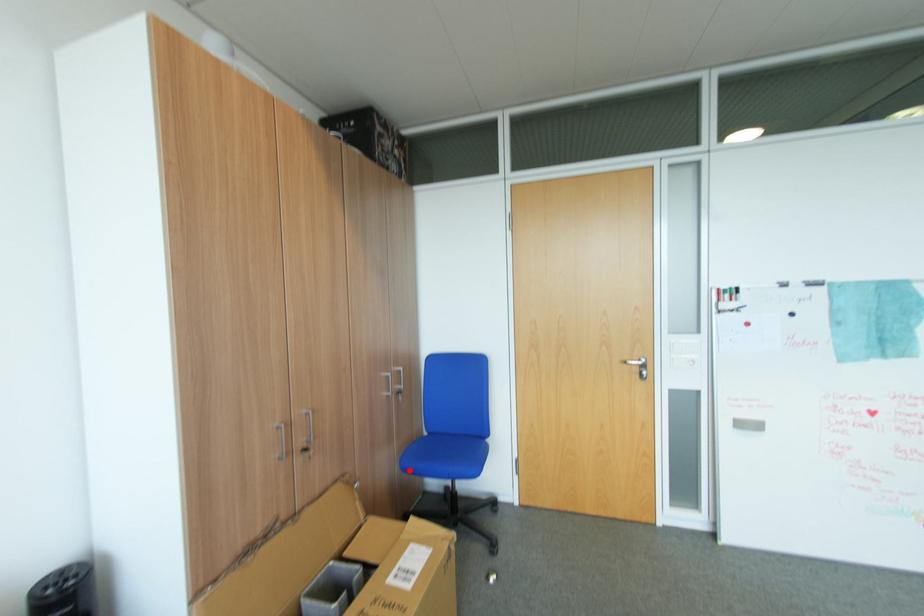
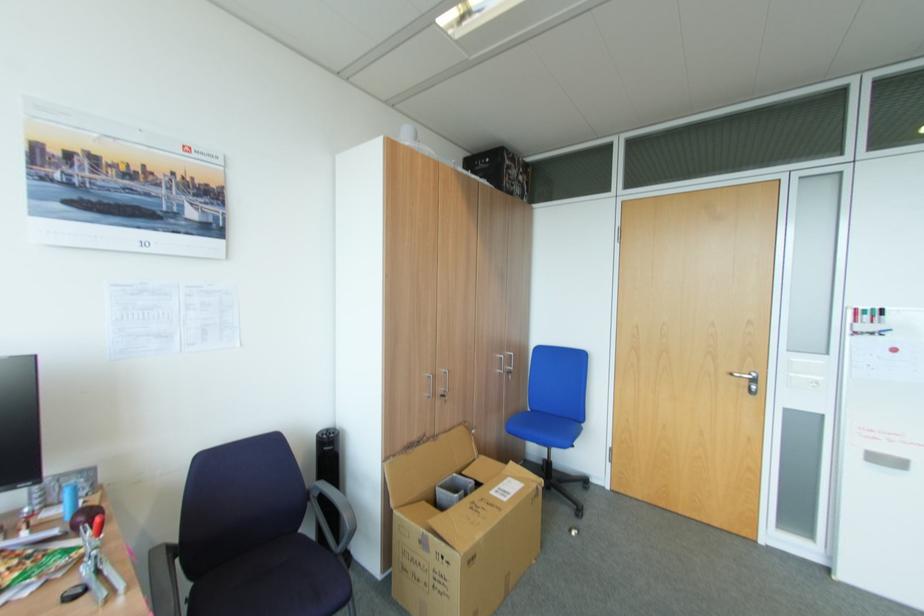
Question: A red point is marked in image1. In image2, is the corresponding 3D point closer to the camera or farther? Reply with the corresponding letter.

Choices:
 (A) The corresponding 3D point is closer.
 (B) The corresponding 3D point is farther.

Answer: (A)